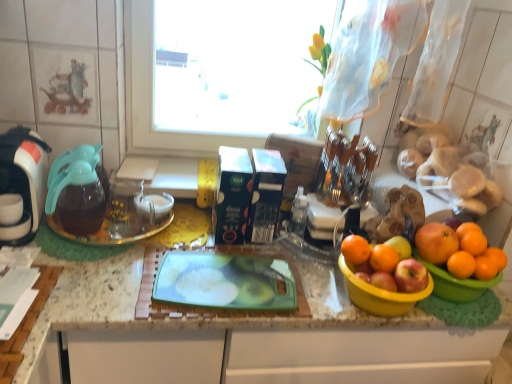
At what (x,y) coordinates should I click in order to perform the action: click on vacant area that lies in front of transparent glass plate at left. Please return your answer as a coordinate pair (x, y). Looking at the image, I should click on (98, 282).